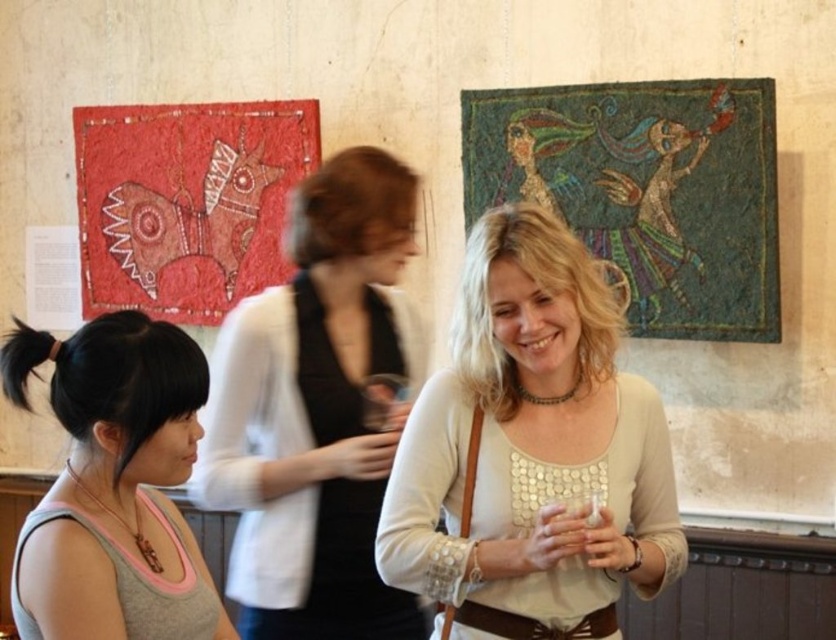
Is point (732, 108) behind point (60, 360)?

Yes, point (732, 108) is behind point (60, 360).

Find the location of `textured mosaic at upper right`. textured mosaic at upper right is located at coordinates (646, 189).

I want to click on textured mosaic at upper right, so click(x=646, y=189).

Does gray fabric tank top at lower left appear over red fabric quilt at left?

Actually, gray fabric tank top at lower left is below red fabric quilt at left.

Does gray fabric tank top at lower left have a larger size compared to red fabric quilt at left?

Incorrect, gray fabric tank top at lower left is not larger than red fabric quilt at left.

Which is behind, point (217, 604) or point (181, 294)?

The point (181, 294) is behind.

Find the location of `gray fabric tank top at lower left`. gray fabric tank top at lower left is located at coordinates (125, 435).

Does light beige sweater at center have a greater height compared to white matte sweater at center?

No.

What do you see at coordinates (533, 449) in the screenshot? I see `light beige sweater at center` at bounding box center [533, 449].

Image resolution: width=836 pixels, height=640 pixels. I want to click on light beige sweater at center, so click(x=533, y=449).